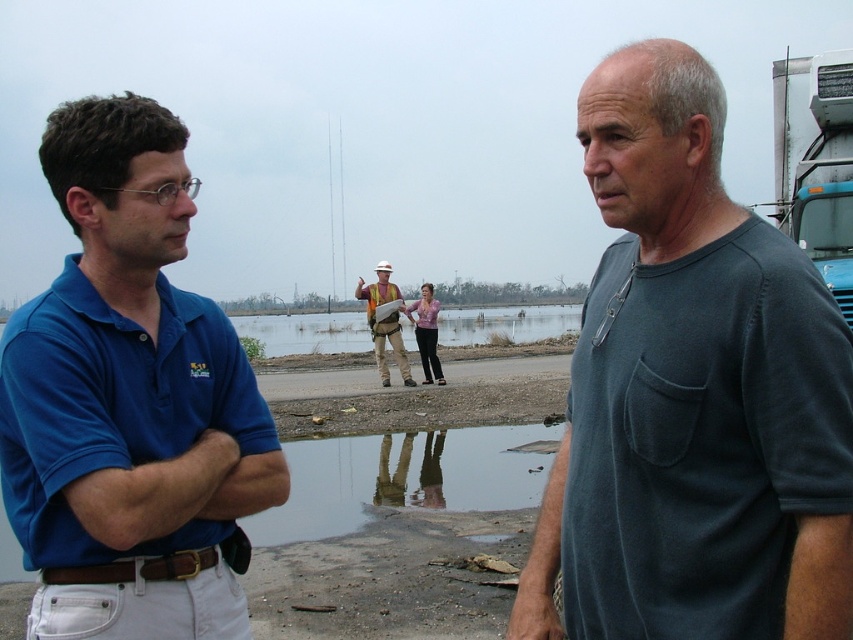
Question: Which of the following is the farthest from the observer?

Choices:
 (A) brown dirt road at center
 (B) teal glossy trailer truck at upper right
 (C) hard hat construction worker at center

Answer: (A)

Question: Among these objects, which one is nearest to the camera?

Choices:
 (A) dark gray t-shirt at center
 (B) blue cotton polo shirt at left
 (C) transparent reflective puddle at center
 (D) teal glossy trailer truck at upper right

Answer: (A)

Question: Which of these objects is positioned farthest from the blue cotton polo shirt at left?

Choices:
 (A) dark gray t-shirt at center
 (B) teal glossy trailer truck at upper right
 (C) hard hat construction worker at center

Answer: (C)

Question: Does dark gray t-shirt at center have a lesser width compared to teal glossy trailer truck at upper right?

Choices:
 (A) yes
 (B) no

Answer: (A)

Question: Does transparent reflective puddle at center appear under brown dirt road at center?

Choices:
 (A) yes
 (B) no

Answer: (A)

Question: Considering the relative positions of transparent reflective puddle at center and teal glossy trailer truck at upper right in the image provided, where is transparent reflective puddle at center located with respect to teal glossy trailer truck at upper right?

Choices:
 (A) right
 (B) left

Answer: (B)